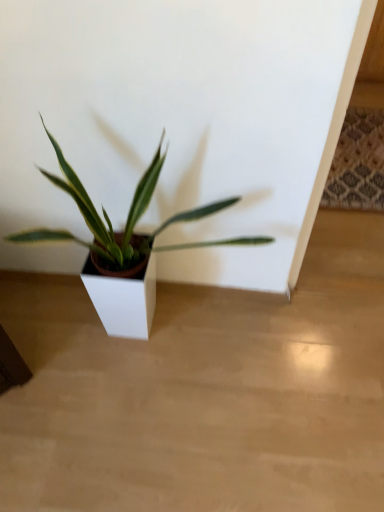
Identify the location of green glossy plant at center. The image size is (384, 512). (127, 248).

Measure the distance between green glossy plant at center and camera.

green glossy plant at center is 98.60 centimeters away from camera.

Describe the element at coordinates (127, 248) in the screenshot. This screenshot has height=512, width=384. I see `green glossy plant at center` at that location.

The width and height of the screenshot is (384, 512). I want to click on green glossy plant at center, so click(127, 248).